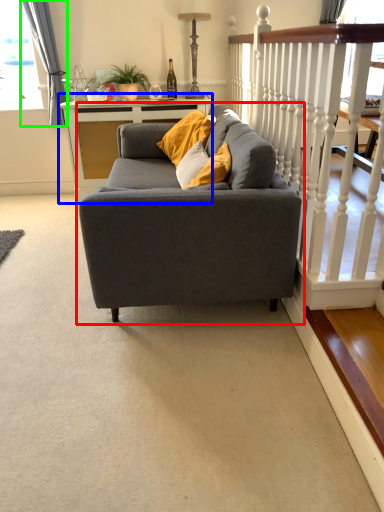
Question: Which object is positioned closest to studio couch (highlighted by a red box)? Select from table (highlighted by a blue box) and curtain (highlighted by a green box).

Choices:
 (A) table
 (B) curtain

Answer: (A)